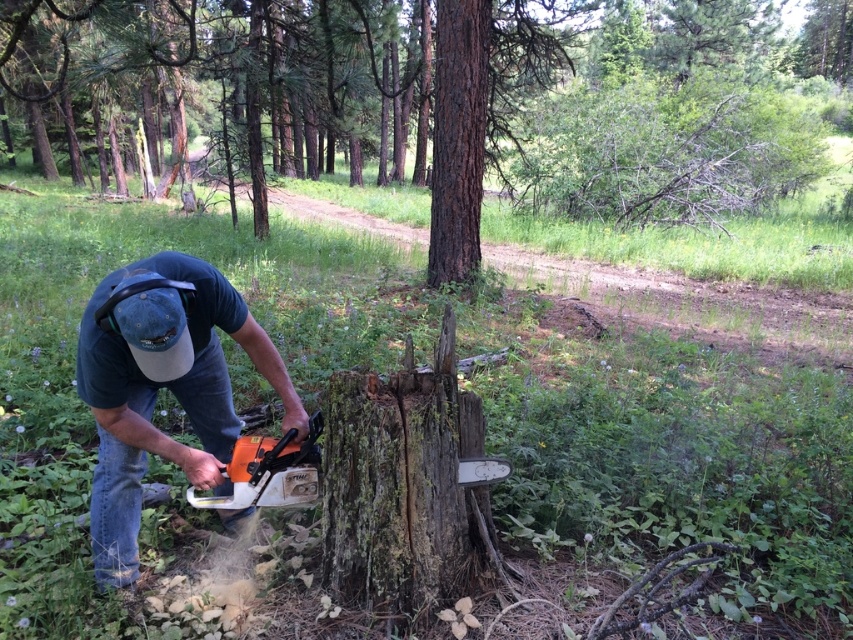
Question: Estimate the real-world distances between objects in this image. Which object is farther from the brown rough bark tree trunk at center?

Choices:
 (A) orange plastic chainsaw at lower center
 (B) orange plastic chainsaw at lower left
 (C) smooth bark tree stump at center

Answer: (C)

Question: Is smooth bark tree stump at center to the right of orange plastic chainsaw at lower left from the viewer's perspective?

Choices:
 (A) yes
 (B) no

Answer: (A)

Question: Can you confirm if brown rough bark tree trunk at center is positioned to the left of orange plastic chainsaw at lower center?

Choices:
 (A) yes
 (B) no

Answer: (B)

Question: From the image, what is the correct spatial relationship of smooth bark tree stump at center in relation to orange plastic chainsaw at lower center?

Choices:
 (A) below
 (B) above

Answer: (B)

Question: Which of these objects is positioned closest to the orange plastic chainsaw at lower center?

Choices:
 (A) smooth bark tree stump at center
 (B) brown rough bark tree trunk at center
 (C) orange plastic chainsaw at lower left

Answer: (C)

Question: Among these points, which one is farthest from the camera?

Choices:
 (A) (347, 49)
 (B) (477, 97)

Answer: (A)